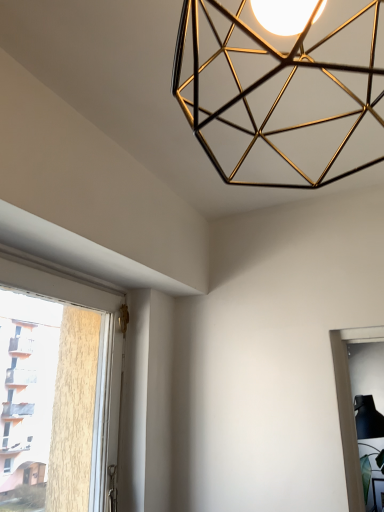
Question: Is point (185, 18) closer or farther from the camera than point (61, 279)?

Choices:
 (A) closer
 (B) farther

Answer: (A)

Question: Considering the positions of gold metallic geometric light fixture at upper center and white plastic window at left, arranged as the 1th window when viewed from the top, in the image, is gold metallic geometric light fixture at upper center taller or shorter than white plastic window at left, arranged as the 1th window when viewed from the top,?

Choices:
 (A) tall
 (B) short

Answer: (B)

Question: Considering the real-world distances, which object is closest to the transparent glass window at lower right, which is the second window in left-to-right order?

Choices:
 (A) gold metallic geometric light fixture at upper center
 (B) white plastic window at left, placed as the second window when sorted from back to front

Answer: (A)

Question: Considering the real-world distances, which object is farthest from the white plastic window at left, the 2th window from the right?

Choices:
 (A) gold metallic geometric light fixture at upper center
 (B) transparent glass window at lower right, which is the 2th window from front to back

Answer: (B)